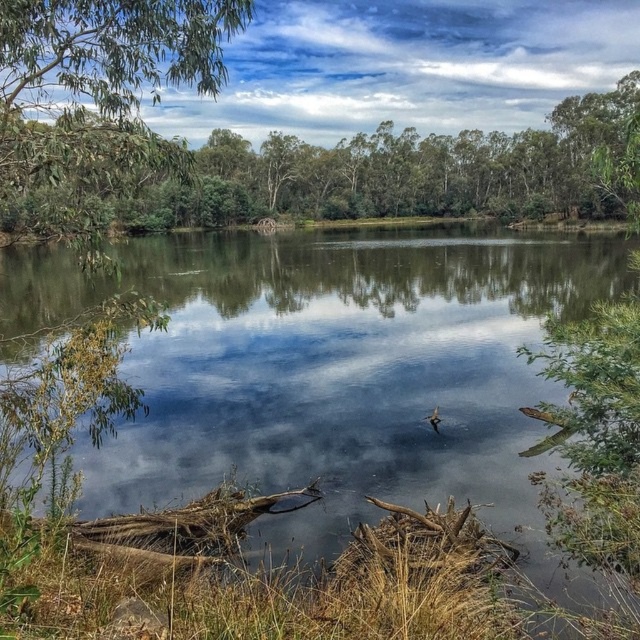
You are planning to place a small wooden boat in the scene. The boat requires a space wider than the green leafy tree at upper left to float. Based on the scene description, can the clear water at center accommodate the boat?

The clear water at center might be wider than the green leafy tree at upper left, so it is possible that the clear water at center can accommodate the boat if its width meets the requirement.

You are standing at the edge of the water in the scene. There is a point marked at coordinates (333, 371) which is clear water at center. If you want to find the clearest part of the water, where should you look?

The clearest part of the water is at the point marked (333, 371), which is the clear water at center.